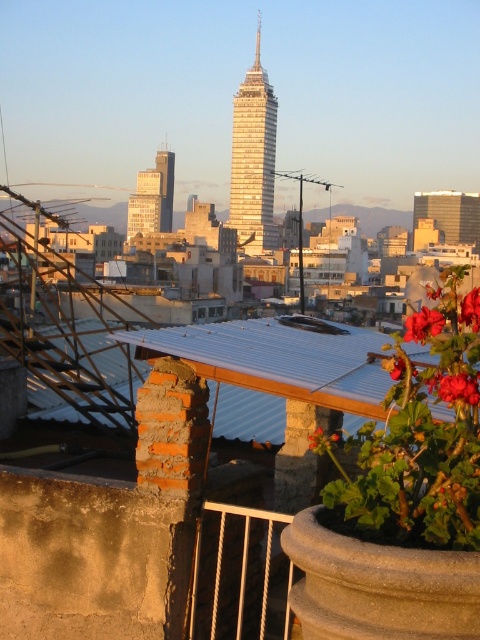
You are a drone operator planning to fly a drone from the rooftop where the metallic blue roof at center and glassy reflective skyscraper at center are located. Considering their heights, which object would require the drone to ascend higher to reach its top?

The glassy reflective skyscraper at center is taller than the metallic blue roof at center, so the drone would need to ascend higher to reach its top.

You are an urban planner assessing the cityscape. You need to determine if the matte glass building at center can be seen from the viewpoint of the vivid red petals at center right. Based on their relative positions and sizes, can the building obstruct the view of the horizon from the petals? Please explain.

The matte glass building at center is wider than the vivid red petals at center right. Since the building is larger in width, it could potentially obstruct the view of the horizon from the viewpoint of the vivid red petals at center right depending on their exact positions and elevation.

You are a photographer planning to capture the cityscape from this rooftop. You want to ensure both the metallic blue roof at center and the glassy reflective skyscraper at center are clearly visible in your shot. Given their sizes, which object might you need to adjust your camera angle to emphasize more?

The metallic blue roof at center has a smaller size compared to the glassy reflective skyscraper at center, so you might need to adjust your camera angle to emphasize the metallic blue roof at center to ensure it is clearly visible alongside the larger skyscraper.